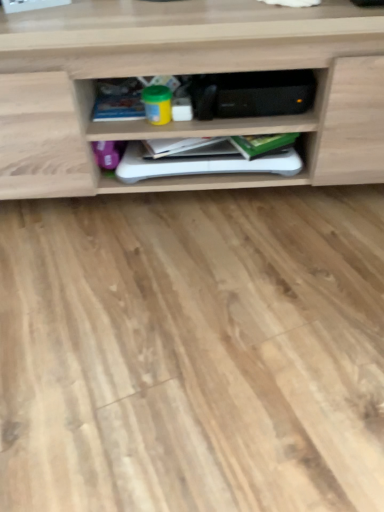
Question: Is blue matte book at center, the 1th book viewed from the left, at the left side of green matte book at center, the third book in the left-to-right sequence?

Choices:
 (A) yes
 (B) no

Answer: (A)

Question: Is blue matte book at center, the 1th book viewed from the left, facing towards green matte book at center, the third book in the left-to-right sequence?

Choices:
 (A) yes
 (B) no

Answer: (B)

Question: From the image's perspective, is blue matte book at center, the 1th book viewed from the left, located above green matte book at center, the third book in the left-to-right sequence?

Choices:
 (A) yes
 (B) no

Answer: (A)

Question: Is blue matte book at center, which appears as the third book when viewed from the right, not inside green matte book at center, the third book in the left-to-right sequence?

Choices:
 (A) yes
 (B) no

Answer: (A)

Question: Is blue matte book at center, which appears as the third book when viewed from the right, thinner than green matte book at center, the third book in the left-to-right sequence?

Choices:
 (A) yes
 (B) no

Answer: (B)

Question: Is blue matte book at center, the 1th book viewed from the left, taller or shorter than green matte book at center, the third book in the left-to-right sequence?

Choices:
 (A) tall
 (B) short

Answer: (B)

Question: Is point (94, 109) positioned closer to the camera than point (258, 146)?

Choices:
 (A) farther
 (B) closer

Answer: (A)

Question: Is blue matte book at center, the 1th book viewed from the left, inside or outside of green matte book at center, the third book in the left-to-right sequence?

Choices:
 (A) inside
 (B) outside

Answer: (B)

Question: Looking at their shapes, would you say blue matte book at center, the 1th book viewed from the left, is wider or thinner than green matte book at center, which appears as the first book when viewed from the right?

Choices:
 (A) wide
 (B) thin

Answer: (A)

Question: Is point (266, 140) closer or farther from the camera than point (130, 146)?

Choices:
 (A) closer
 (B) farther

Answer: (A)

Question: Considering the positions of green matte book at center, which appears as the first book when viewed from the right, and white matte book at center, placed as the second book when sorted from left to right, in the image, is green matte book at center, which appears as the first book when viewed from the right, taller or shorter than white matte book at center, placed as the second book when sorted from left to right,?

Choices:
 (A) short
 (B) tall

Answer: (A)

Question: Considering their positions, is green matte book at center, which appears as the first book when viewed from the right, located in front of or behind white matte book at center, placed as the second book when sorted from left to right?

Choices:
 (A) front
 (B) behind

Answer: (A)

Question: Choose the correct answer: Is green matte book at center, the third book in the left-to-right sequence, inside white matte book at center, placed as the second book when sorted from left to right, or outside it?

Choices:
 (A) outside
 (B) inside

Answer: (A)

Question: Looking at their shapes, would you say wooden shelf at center is wider or thinner than green matte book at center, the third book in the left-to-right sequence?

Choices:
 (A) wide
 (B) thin

Answer: (A)

Question: From the image's perspective, is wooden shelf at center located above or below green matte book at center, which appears as the first book when viewed from the right?

Choices:
 (A) below
 (B) above

Answer: (B)